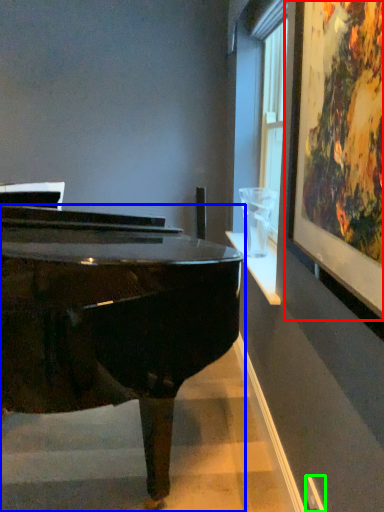
Question: Which object is the farthest from picture frame (highlighted by a red box)? Choose among these: piano (highlighted by a blue box) or power outlet (highlighted by a green box).

Choices:
 (A) piano
 (B) power outlet

Answer: (B)